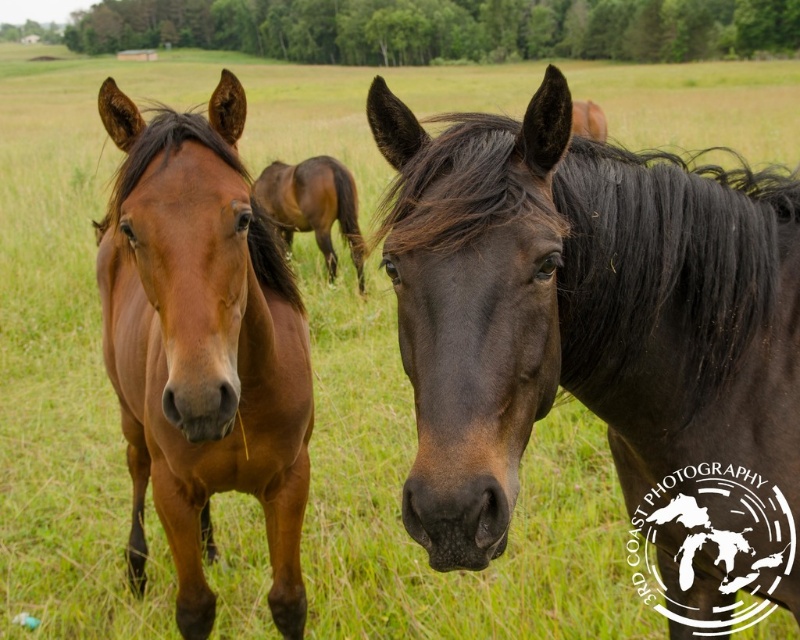
Question: Among these points, which one is farthest from the camera?

Choices:
 (A) (298, 189)
 (B) (260, 451)
 (C) (688, 458)

Answer: (A)

Question: Does shiny brown horse at center appear under brown glossy horse at center?

Choices:
 (A) no
 (B) yes

Answer: (B)

Question: Can you confirm if shiny dark brown horse at center is bigger than shiny brown horse at center?

Choices:
 (A) yes
 (B) no

Answer: (B)

Question: Which of the following is the closest to the observer?

Choices:
 (A) brown glossy horse at center
 (B) shiny brown horse at center

Answer: (B)

Question: Does shiny dark brown horse at center have a greater width compared to shiny brown horse at center?

Choices:
 (A) yes
 (B) no

Answer: (B)

Question: Estimate the real-world distances between objects in this image. Which object is closer to the brown glossy horse at center?

Choices:
 (A) shiny dark brown horse at center
 (B) shiny brown horse at center

Answer: (B)